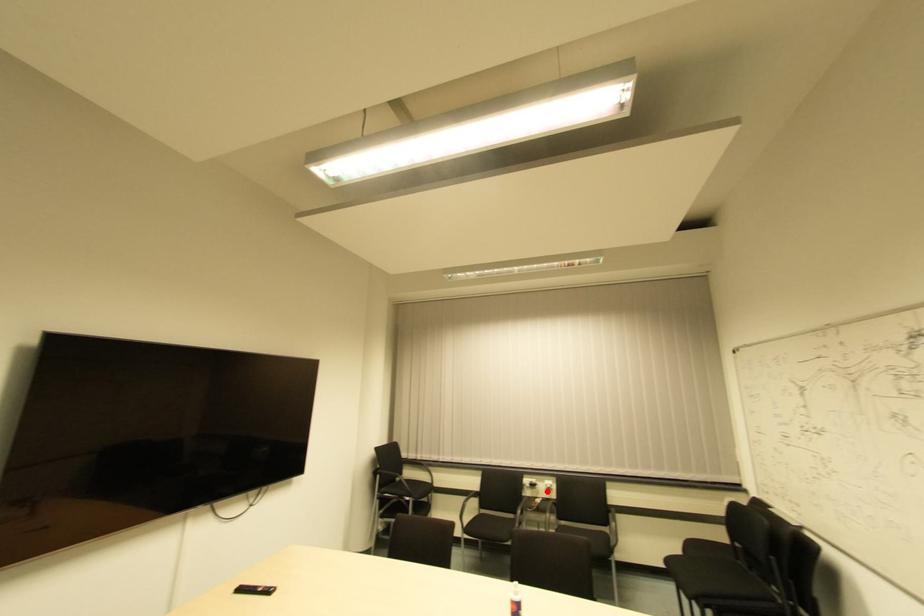
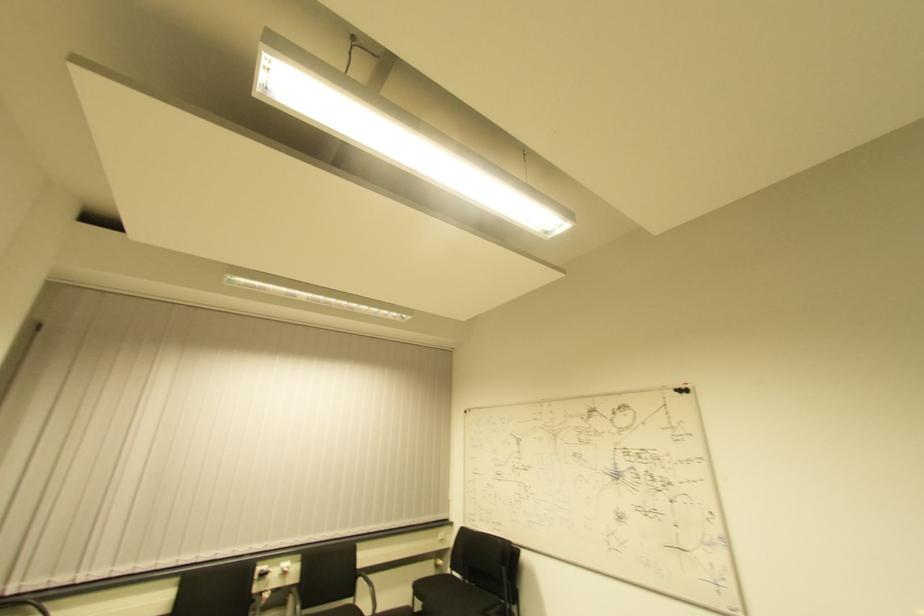
Question: I am providing you with two images of the same scene from different viewpoints. In image1, a red point is highlighted. Considering the same 3D point in image2, which of the following is correct?

Choices:
 (A) It is closer
 (B) It is farther

Answer: (A)